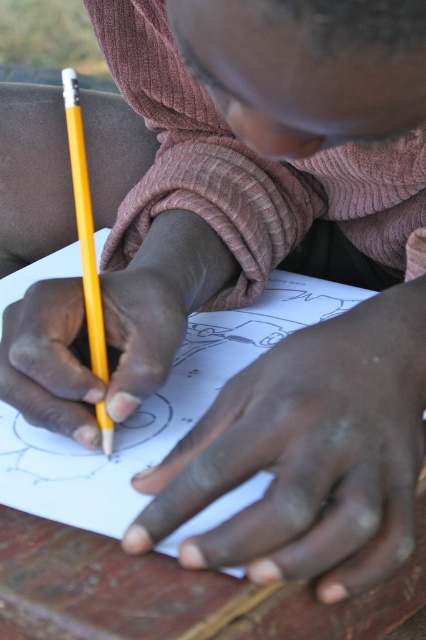
You are a dermatologist examining a patient. The patient has a skin condition at point (307, 456). Based on the image, what is the location of the dry skin relative to the person?

The point (307, 456) indicates dry skin at center, so the dry skin is located at the center of the person.

You are an artist trying to avoid smudging your drawing. You notice the dry skin at center and the yellow wood pencil at lower left. Which object should you move to prevent touching the paper?

You should move the dry skin at center because it is located below the yellow wood pencil at lower left and closer to the paper, increasing the risk of smudging.